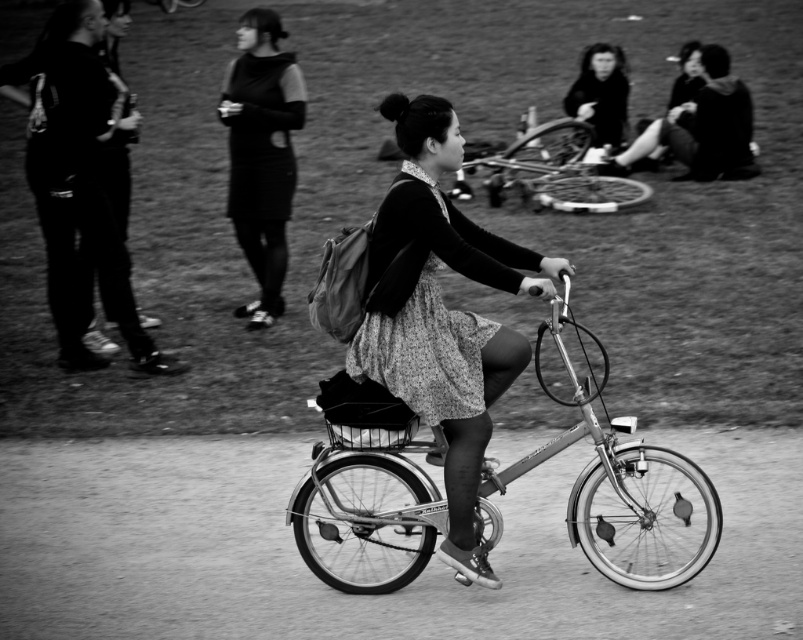
Is metallic silver bicycle at upper right closer to camera compared to smooth black hair at upper right?

Yes, it is.

Who is more forward, (512, 173) or (613, 97)?

Point (512, 173)

Where is `metallic silver bicycle at upper right`? The image size is (803, 640). metallic silver bicycle at upper right is located at coordinates (557, 172).

Between point (549, 276) and point (272, 99), which one is positioned behind?

Positioned behind is point (272, 99).

Does point (449, 129) come in front of point (275, 45)?

Yes, it is.

Identify the location of floral dress at center. Image resolution: width=803 pixels, height=640 pixels. (441, 314).

Locate an element on the screen. Image resolution: width=803 pixels, height=640 pixels. floral dress at center is located at coordinates (441, 314).

Between point (475, 563) and point (604, 209), which one is positioned behind?

Point (604, 209)

The image size is (803, 640). Describe the element at coordinates (441, 314) in the screenshot. I see `floral dress at center` at that location.

Locate an element on the screen. floral dress at center is located at coordinates (441, 314).